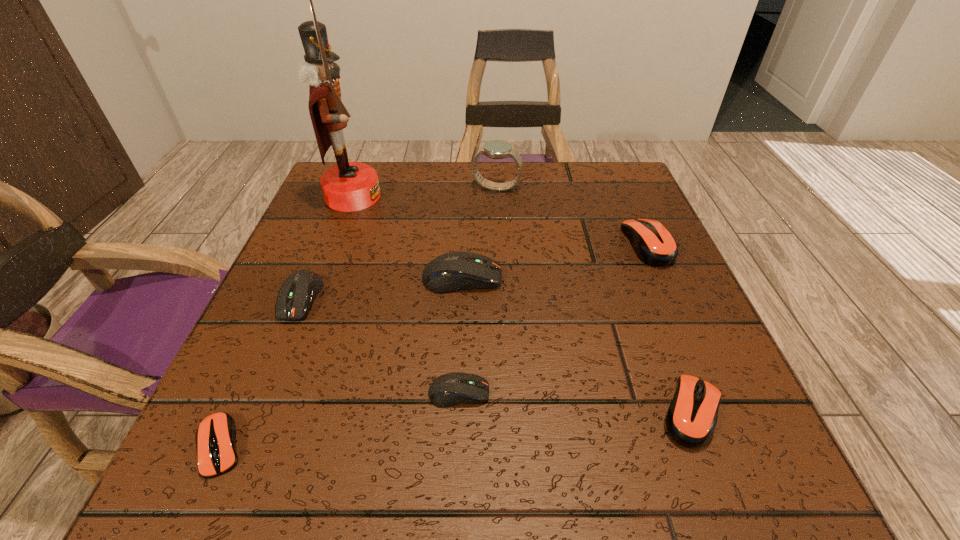
At what (x,y) coordinates should I click in order to perform the action: click on nutcracker located in the far edge section of the desktop. Please return your answer as a coordinate pair (x, y). The width and height of the screenshot is (960, 540). Looking at the image, I should click on (347, 186).

Identify the location of watch present at the far edge. (496, 149).

The image size is (960, 540). Identify the location of nutcracker that is at the left edge. (347, 186).

The width and height of the screenshot is (960, 540). Find the location of `object that is at the far left corner`. object that is at the far left corner is located at coordinates (347, 186).

Image resolution: width=960 pixels, height=540 pixels. Find the location of `object that is at the near left corner`. object that is at the near left corner is located at coordinates (215, 437).

Where is `object located in the near right corner section of the desktop`? Image resolution: width=960 pixels, height=540 pixels. object located in the near right corner section of the desktop is located at coordinates click(x=691, y=418).

Locate an element on the screen. vacant space at the far edge of the desktop is located at coordinates (455, 194).

Where is `vacant space at the near edge of the desktop`? The image size is (960, 540). vacant space at the near edge of the desktop is located at coordinates (500, 499).

At what (x,y) coordinates should I click in order to perform the action: click on blank space at the left edge. Please return your answer as a coordinate pair (x, y). Looking at the image, I should click on (334, 372).

The image size is (960, 540). In the image, there is a desktop. What are the coordinates of `free space at the right edge` in the screenshot? It's located at (582, 221).